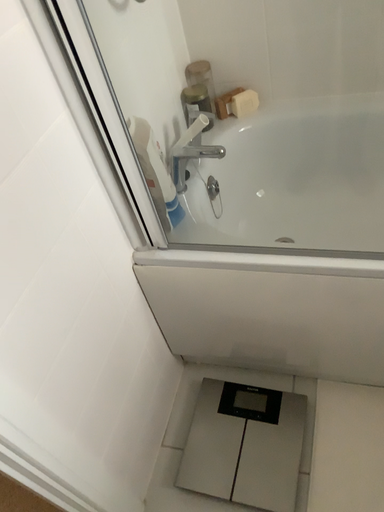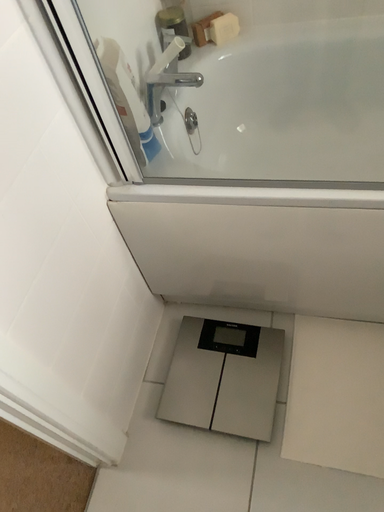
Question: Which way did the camera rotate in the video?

Choices:
 (A) rotated upward
 (B) rotated downward

Answer: (B)